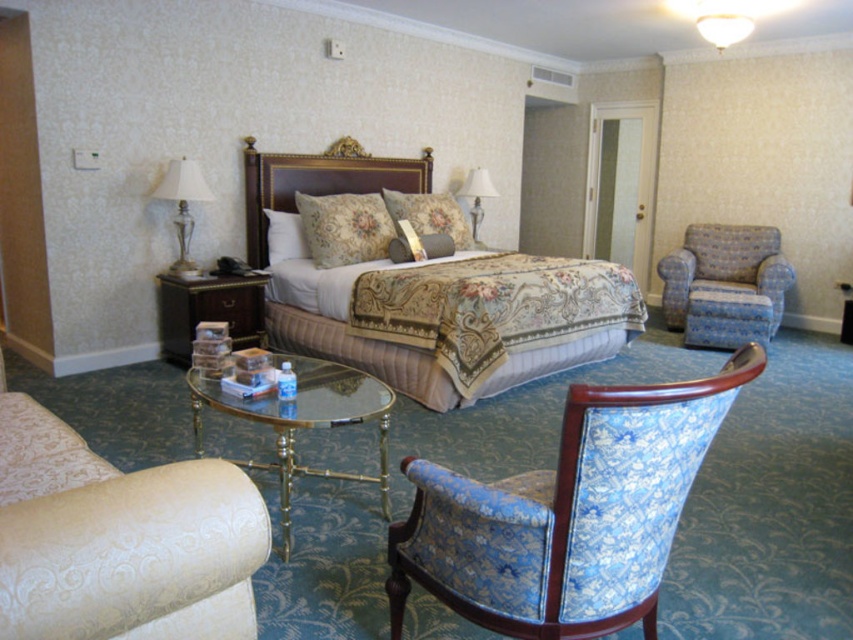
Question: Is blue fabric swivel chair at right further to the viewer compared to clear glass table at center?

Choices:
 (A) yes
 (B) no

Answer: (A)

Question: Does clear glass table at center have a lesser width compared to fluffy white pillow at center?

Choices:
 (A) yes
 (B) no

Answer: (B)

Question: Based on their relative distances, which object is nearer to the clear glass table at center?

Choices:
 (A) gold-patterned fabric bed at center
 (B) floral fabric pillow at center

Answer: (A)

Question: Which object is the closest to the matte cream fabric couch at lower left?

Choices:
 (A) matte glass lampshade at upper left
 (B) blue floral fabric swivel chair at lower right
 (C) blue fabric swivel chair at right
 (D) gold-patterned fabric bed at center

Answer: (B)

Question: Which point is closer to the camera taking this photo?

Choices:
 (A) pos(289,244)
 (B) pos(193,172)
 (C) pos(68,496)

Answer: (C)

Question: Can you confirm if clear glass table at center is positioned below matte glass lampshade at upper left?

Choices:
 (A) yes
 (B) no

Answer: (A)